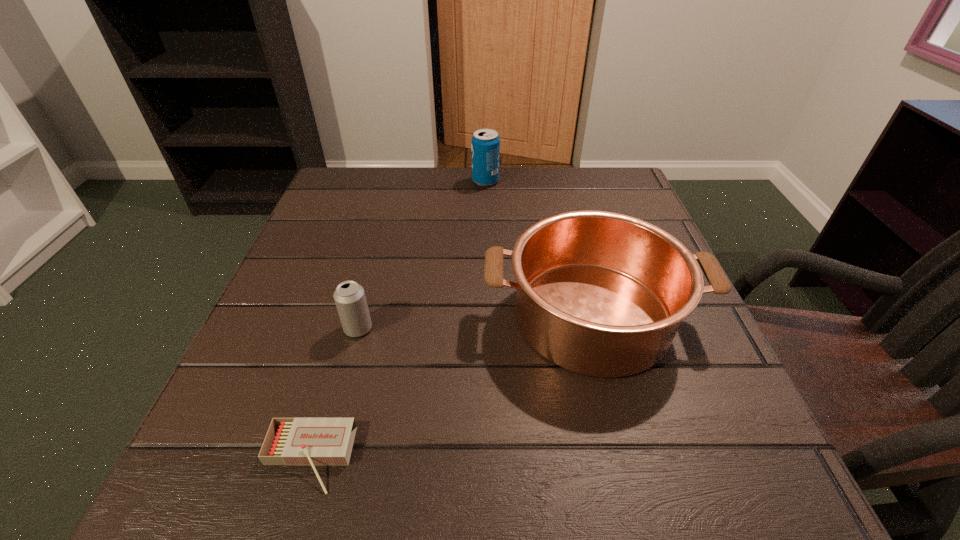
Locate an element on the screen. the second closest object to the nearest object is located at coordinates (602, 294).

Locate an element on the screen. free space that satisfies the following two spatial constraints: 1. on the back side of the second shortest object; 2. on the right side of the saucepan is located at coordinates point(362,316).